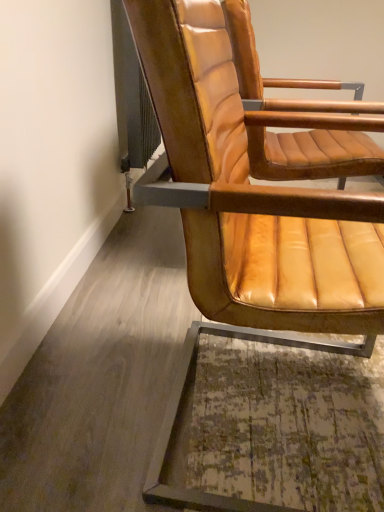
This screenshot has width=384, height=512. Find the location of `leather at right, the first chair viewed from the front`. leather at right, the first chair viewed from the front is located at coordinates (249, 215).

The image size is (384, 512). Describe the element at coordinates (249, 215) in the screenshot. I see `leather at right, which is the 2th chair from back to front` at that location.

You are a GUI agent. You are given a task and a screenshot of the screen. Output one action in this format:
    pyautogui.click(x=<x>, y=<y>)
    Task: Click on the tan leather chair at center, positioned as the second chair in front-to-back order
    This screenshot has width=384, height=512.
    Given the screenshot: What is the action you would take?
    pyautogui.click(x=314, y=154)

This screenshot has height=512, width=384. Describe the element at coordinates (314, 154) in the screenshot. I see `tan leather chair at center, placed as the 1th chair when sorted from back to front` at that location.

What is the approximate width of tan leather chair at center, positioned as the second chair in front-to-back order?

tan leather chair at center, positioned as the second chair in front-to-back order, is 25.39 inches in width.

This screenshot has width=384, height=512. I want to click on leather at right, the first chair viewed from the front, so click(249, 215).

Would you say leather at right, the first chair viewed from the front, is to the left or to the right of tan leather chair at center, positioned as the second chair in front-to-back order, in the picture?

leather at right, the first chair viewed from the front, is positioned on tan leather chair at center, positioned as the second chair in front-to-back order,'s left side.

Considering the positions of objects leather at right, the first chair viewed from the front, and tan leather chair at center, positioned as the second chair in front-to-back order, in the image provided, who is in front, leather at right, the first chair viewed from the front, or tan leather chair at center, positioned as the second chair in front-to-back order,?

leather at right, the first chair viewed from the front, is more forward.

Considering the points (154, 486) and (310, 108), which point is in front, point (154, 486) or point (310, 108)?

The point (154, 486) is in front.

From the image's perspective, relative to tan leather chair at center, placed as the 1th chair when sorted from back to front, is leather at right, the first chair viewed from the front, above or below?

Clearly, from the image's perspective, leather at right, the first chair viewed from the front, is below tan leather chair at center, placed as the 1th chair when sorted from back to front.

From a real-world perspective, is leather at right, which is the 2th chair from back to front, physically below tan leather chair at center, positioned as the second chair in front-to-back order?

Indeed, from a real-world perspective, leather at right, which is the 2th chair from back to front, is positioned beneath tan leather chair at center, positioned as the second chair in front-to-back order.

Is leather at right, the first chair viewed from the front, wider than tan leather chair at center, placed as the 1th chair when sorted from back to front?

In fact, leather at right, the first chair viewed from the front, might be narrower than tan leather chair at center, placed as the 1th chair when sorted from back to front.

Which of these two, leather at right, which is the 2th chair from back to front, or tan leather chair at center, positioned as the second chair in front-to-back order, stands taller?

With more height is leather at right, which is the 2th chair from back to front.

Looking at this image, in terms of size, does leather at right, which is the 2th chair from back to front, appear bigger or smaller than tan leather chair at center, placed as the 1th chair when sorted from back to front?

Clearly, leather at right, which is the 2th chair from back to front, is larger in size than tan leather chair at center, placed as the 1th chair when sorted from back to front.

Is tan leather chair at center, positioned as the second chair in front-to-back order, a part of leather at right, which is the 2th chair from back to front?

No, tan leather chair at center, positioned as the second chair in front-to-back order, is not surrounded by leather at right, which is the 2th chair from back to front.

Are leather at right, which is the 2th chair from back to front, and tan leather chair at center, placed as the 1th chair when sorted from back to front, making contact?

leather at right, which is the 2th chair from back to front, is not next to tan leather chair at center, placed as the 1th chair when sorted from back to front, and they're not touching.

Does leather at right, the first chair viewed from the front, turn towards tan leather chair at center, placed as the 1th chair when sorted from back to front?

No, leather at right, the first chair viewed from the front, is not oriented towards tan leather chair at center, placed as the 1th chair when sorted from back to front.

Measure the distance from leather at right, the first chair viewed from the front, to tan leather chair at center, positioned as the second chair in front-to-back order.

leather at right, the first chair viewed from the front, and tan leather chair at center, positioned as the second chair in front-to-back order, are 12.27 inches apart.

Find the location of `chair above the leather at right, which is the 2th chair from back to front (from a real-world perspective)`. chair above the leather at right, which is the 2th chair from back to front (from a real-world perspective) is located at coordinates (314, 154).

Is tan leather chair at center, positioned as the second chair in front-to-back order, at the left side of leather at right, which is the 2th chair from back to front?

No.

Which object is further away from the camera taking this photo, tan leather chair at center, placed as the 1th chair when sorted from back to front, or leather at right, the first chair viewed from the front?

Positioned behind is tan leather chair at center, placed as the 1th chair when sorted from back to front.

Considering the points (366, 106) and (266, 233), which point is behind, point (366, 106) or point (266, 233)?

The point (366, 106) is farther.

From the image's perspective, between tan leather chair at center, placed as the 1th chair when sorted from back to front, and leather at right, the first chair viewed from the front, which one is located above?

From the image's view, tan leather chair at center, placed as the 1th chair when sorted from back to front, is above.

From a real-world perspective, which is physically above, tan leather chair at center, placed as the 1th chair when sorted from back to front, or leather at right, the first chair viewed from the front?

tan leather chair at center, placed as the 1th chair when sorted from back to front, is physically above.

Is tan leather chair at center, placed as the 1th chair when sorted from back to front, wider than leather at right, which is the 2th chair from back to front?

Indeed, tan leather chair at center, placed as the 1th chair when sorted from back to front, has a greater width compared to leather at right, which is the 2th chair from back to front.

Between tan leather chair at center, placed as the 1th chair when sorted from back to front, and leather at right, the first chair viewed from the front, which one has more height?

leather at right, the first chair viewed from the front, is taller.

Between tan leather chair at center, positioned as the second chair in front-to-back order, and leather at right, the first chair viewed from the front, which one has larger size?

leather at right, the first chair viewed from the front.

Is tan leather chair at center, positioned as the second chair in front-to-back order, located outside leather at right, which is the 2th chair from back to front?

Indeed, tan leather chair at center, positioned as the second chair in front-to-back order, is completely outside leather at right, which is the 2th chair from back to front.

Is the surface of tan leather chair at center, placed as the 1th chair when sorted from back to front, in direct contact with leather at right, the first chair viewed from the front?

There is a gap between tan leather chair at center, placed as the 1th chair when sorted from back to front, and leather at right, the first chair viewed from the front.

Does tan leather chair at center, positioned as the second chair in front-to-back order, turn towards leather at right, the first chair viewed from the front?

No, tan leather chair at center, positioned as the second chair in front-to-back order, is not facing towards leather at right, the first chair viewed from the front.

Can you tell me how much tan leather chair at center, positioned as the second chair in front-to-back order, and leather at right, which is the 2th chair from back to front, differ in facing direction?

The angular difference between tan leather chair at center, positioned as the second chair in front-to-back order, and leather at right, which is the 2th chair from back to front, is 4.02 degrees.

Where is `chair in front of the tan leather chair at center, positioned as the second chair in front-to-back order`? chair in front of the tan leather chair at center, positioned as the second chair in front-to-back order is located at coordinates click(249, 215).

You are a GUI agent. You are given a task and a screenshot of the screen. Output one action in this format:
    pyautogui.click(x=<x>, y=<y>)
    Task: Click on the chair that appears below the tan leather chair at center, positioned as the second chair in front-to-back order (from the image's perspective)
    
    Given the screenshot: What is the action you would take?
    pyautogui.click(x=249, y=215)

At what (x,y) coordinates should I click in order to perform the action: click on chair below the tan leather chair at center, placed as the 1th chair when sorted from back to front (from a real-world perspective). Please return your answer as a coordinate pair (x, y). Looking at the image, I should click on click(249, 215).